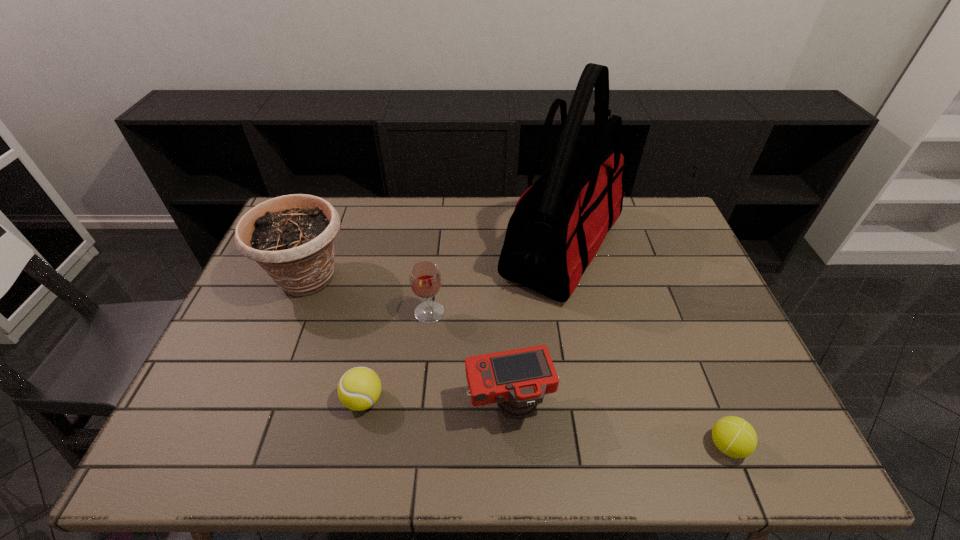
Where is `the tallest object`? This screenshot has height=540, width=960. the tallest object is located at coordinates (559, 223).

The height and width of the screenshot is (540, 960). What are the coordinates of `the fifth shortest object` in the screenshot? It's located at (292, 237).

This screenshot has width=960, height=540. In order to click on the leftmost object in this screenshot , I will do `click(292, 237)`.

Identify the location of wineglass. The width and height of the screenshot is (960, 540). (425, 279).

Locate an element on the screen. camera is located at coordinates (517, 380).

This screenshot has width=960, height=540. Identify the location of the second object from left to right. (359, 388).

Where is `the left tennis ball`? This screenshot has height=540, width=960. the left tennis ball is located at coordinates (359, 388).

Locate an element on the screen. This screenshot has height=540, width=960. the nearer tennis ball is located at coordinates (733, 436).

The height and width of the screenshot is (540, 960). Identify the location of the shorter tennis ball. (733, 436).

The height and width of the screenshot is (540, 960). I want to click on free space located 0.270m on the front of the duffel bag, so click(x=591, y=393).